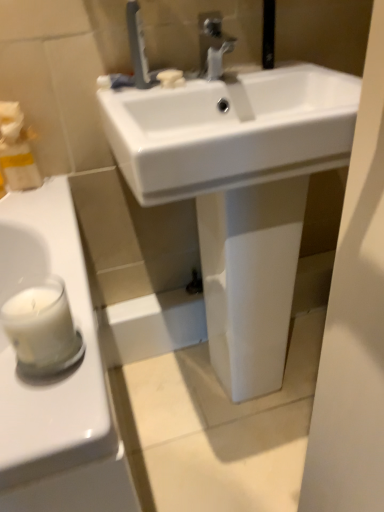
Question: Could you tell me if white glossy sink at center is turned towards satin nickel faucet at upper center, which is the second tap from right to left?

Choices:
 (A) yes
 (B) no

Answer: (B)

Question: Is white glossy sink at center positioned with its back to satin nickel faucet at upper center, the 1th tap positioned from the left?

Choices:
 (A) no
 (B) yes

Answer: (A)

Question: Can you confirm if white glossy sink at center is bigger than satin nickel faucet at upper center, the 1th tap positioned from the left?

Choices:
 (A) yes
 (B) no

Answer: (A)

Question: From the image's perspective, is white glossy sink at center on satin nickel faucet at upper center, which is the second tap from right to left?

Choices:
 (A) yes
 (B) no

Answer: (B)

Question: Does white glossy sink at center have a lesser width compared to satin nickel faucet at upper center, which is the second tap from right to left?

Choices:
 (A) no
 (B) yes

Answer: (A)

Question: From a real-world perspective, is matte silver faucet at upper center, acting as the second tap starting from the left, above or below white matte soap at center?

Choices:
 (A) above
 (B) below

Answer: (A)

Question: Is point (213, 42) closer or farther from the camera than point (175, 74)?

Choices:
 (A) farther
 (B) closer

Answer: (A)

Question: Looking at their shapes, would you say matte silver faucet at upper center, acting as the second tap starting from the left, is wider or thinner than white matte soap at center?

Choices:
 (A) wide
 (B) thin

Answer: (A)

Question: From the image's perspective, is matte silver faucet at upper center, acting as the second tap starting from the left, positioned above or below white matte soap at center?

Choices:
 (A) below
 (B) above

Answer: (B)

Question: Based on their positions, is white glossy sink at center located to the left or right of satin nickel faucet at upper center, which is the second tap from right to left?

Choices:
 (A) left
 (B) right

Answer: (B)

Question: Considering the positions of point (223, 384) and point (135, 79), is point (223, 384) closer or farther from the camera than point (135, 79)?

Choices:
 (A) closer
 (B) farther

Answer: (B)

Question: Looking at the image, does white glossy sink at center seem bigger or smaller compared to satin nickel faucet at upper center, the 1th tap positioned from the left?

Choices:
 (A) small
 (B) big

Answer: (B)

Question: Looking at their shapes, would you say white glossy sink at center is wider or thinner than satin nickel faucet at upper center, which is the second tap from right to left?

Choices:
 (A) thin
 (B) wide

Answer: (B)

Question: Considering the positions of matte silver faucet at upper center, acting as the second tap starting from the left, and white wax candle at left in the image, is matte silver faucet at upper center, acting as the second tap starting from the left, bigger or smaller than white wax candle at left?

Choices:
 (A) small
 (B) big

Answer: (B)

Question: From a real-world perspective, is matte silver faucet at upper center, which is the 1th tap in right-to-left order, physically located above or below white wax candle at left?

Choices:
 (A) above
 (B) below

Answer: (A)